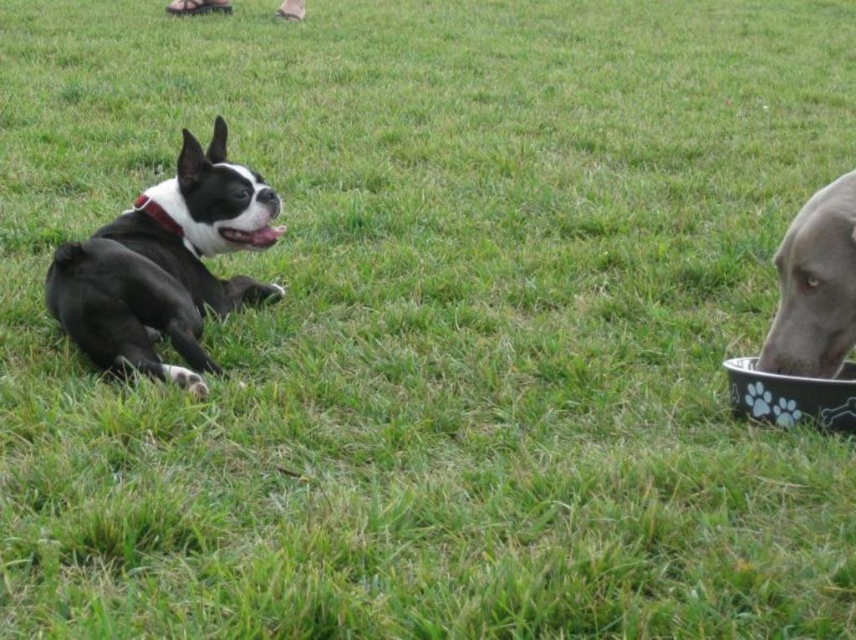
Is point (91, 321) closer to viewer compared to point (785, 422)?

No.

Between black glossy dog at left and black plastic bowl at right, which one appears on the left side from the viewer's perspective?

Positioned to the left is black glossy dog at left.

Which is in front, point (183, 330) or point (735, 360)?

Point (183, 330) is in front.

Find the location of a particular element. black glossy dog at left is located at coordinates (165, 266).

Which of these two, black glossy dog at left or gray matte bowl at right, stands taller?

black glossy dog at left is taller.

This screenshot has width=856, height=640. Describe the element at coordinates (165, 266) in the screenshot. I see `black glossy dog at left` at that location.

Find the location of a particular element. black glossy dog at left is located at coordinates (165, 266).

Between gray matte bowl at right and black plastic bowl at right, which one is positioned lower?

black plastic bowl at right is lower down.

Identify the location of gray matte bowl at right. (815, 285).

I want to click on gray matte bowl at right, so click(x=815, y=285).